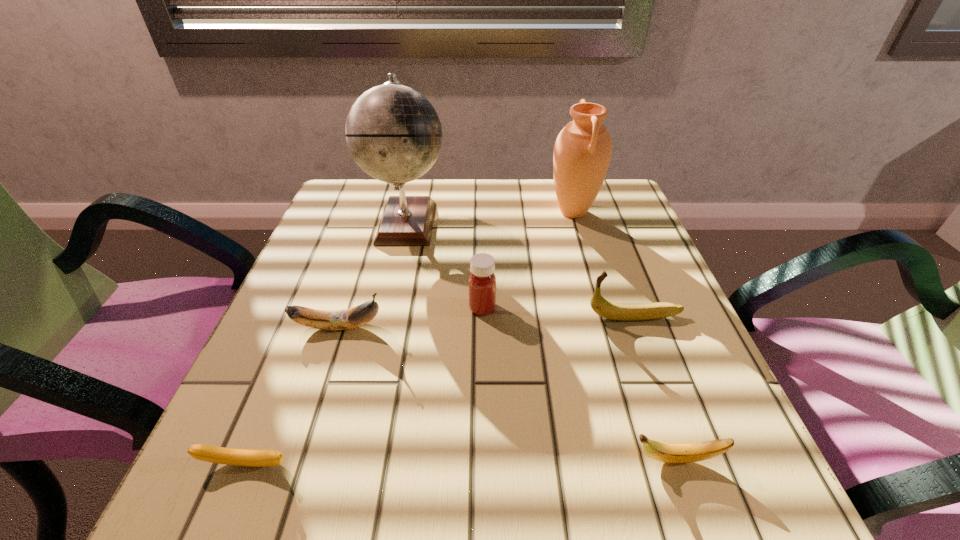
Image resolution: width=960 pixels, height=540 pixels. I want to click on globe, so click(394, 134).

You are a GUI agent. You are given a task and a screenshot of the screen. Output one action in this format:
    pyautogui.click(x=<x>, y=<y>)
    Task: Click on the urn
    Image resolution: width=960 pixels, height=540 pixels.
    Given the screenshot: What is the action you would take?
    pyautogui.click(x=582, y=152)

Identify the location of medicine. (482, 281).

This screenshot has width=960, height=540. I want to click on the third tallest banana, so click(668, 453).

The width and height of the screenshot is (960, 540). I want to click on the shortest banana, so click(x=221, y=455).

The image size is (960, 540). What are the coordinates of `free space located 0.080m at the equator of the tallest object` in the screenshot? It's located at 481,221.

The image size is (960, 540). Identify the location of vacant region located 0.330m on the left of the sixth shortest object. (413, 212).

Find the location of `vacant space located on the back of the medicine`. vacant space located on the back of the medicine is located at coordinates (482, 199).

At what (x,y) coordinates should I click in order to perform the action: click on vacant region located 0.160m at the stem of the sixth tallest object. Please return your answer as a coordinate pair (x, y). Looking at the image, I should click on (515, 460).

Where is `free region located 0.160m at the stem of the sixth tallest object`? This screenshot has width=960, height=540. free region located 0.160m at the stem of the sixth tallest object is located at coordinates (515, 460).